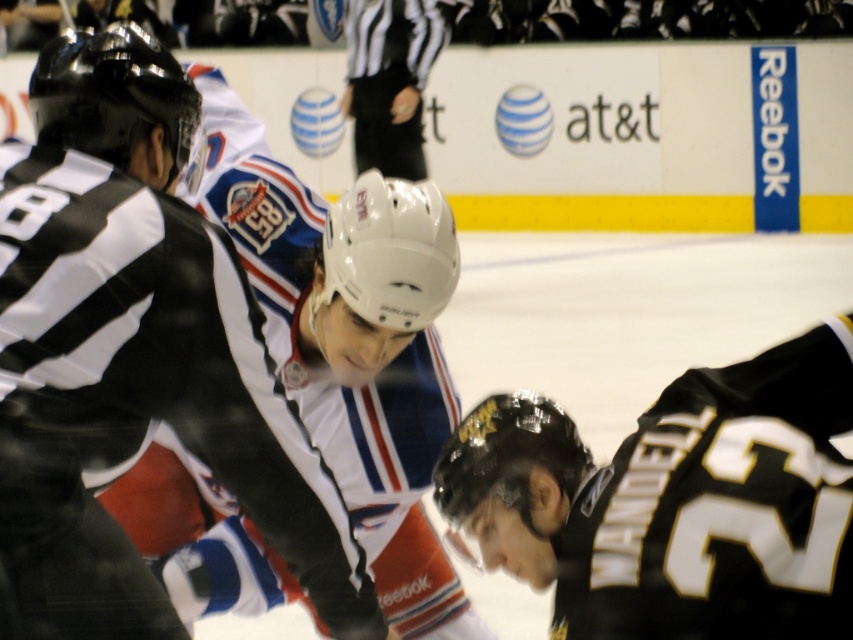
Question: Which point is closer to the camera?

Choices:
 (A) black matte jersey at lower right
 (B) white matte jersey at center
 (C) white matte helmet at upper center

Answer: (B)

Question: Which point appears closest to the camera in this image?

Choices:
 (A) (51, 406)
 (B) (756, 586)

Answer: (A)

Question: Which point appears farthest from the camera in this image?

Choices:
 (A) (421, 125)
 (B) (281, 540)

Answer: (A)

Question: Is white matte jersey at center further to camera compared to black matte jersey at lower right?

Choices:
 (A) no
 (B) yes

Answer: (A)

Question: Where is white matte jersey at center located in relation to white matte helmet at upper center in the image?

Choices:
 (A) below
 (B) above

Answer: (A)

Question: Does black matte jersey at lower right have a lesser width compared to white matte helmet at upper center?

Choices:
 (A) yes
 (B) no

Answer: (A)